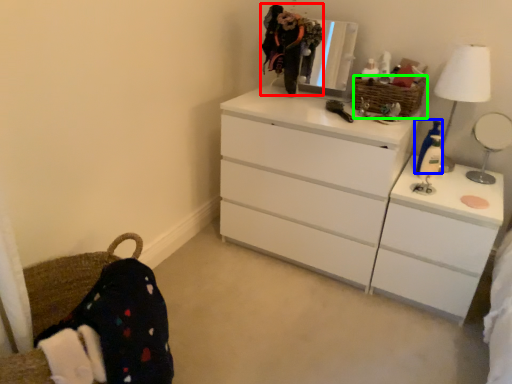
Question: Which object is the closest to the selfie (highlighted by a red box)? Choose among these: toy (highlighted by a blue box) or basket (highlighted by a green box).

Choices:
 (A) toy
 (B) basket

Answer: (B)